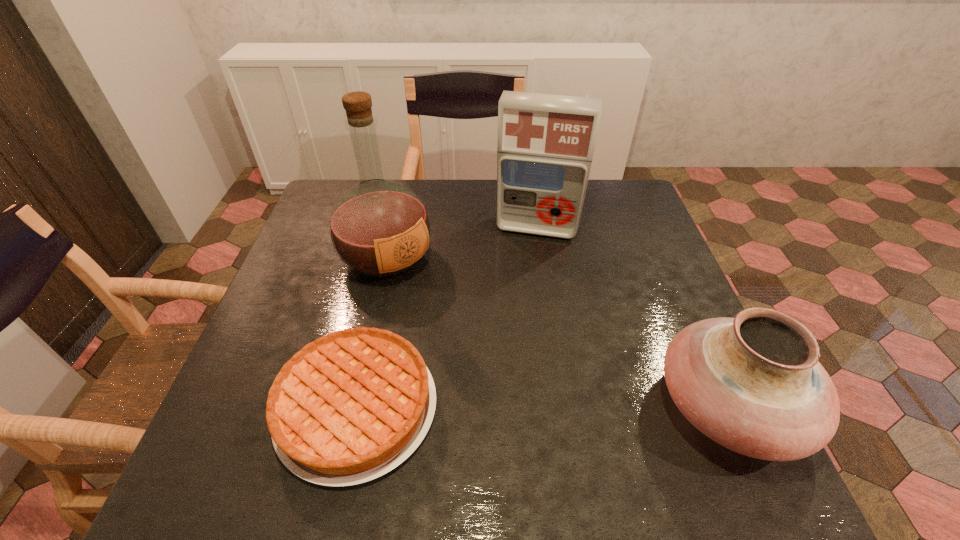
Locate an element on the screen. The width and height of the screenshot is (960, 540). vacant spot on the desktop that is between the shortest object and the pottery and is positioned on the front label of the liquor is located at coordinates (546, 407).

You are a GUI agent. You are given a task and a screenshot of the screen. Output one action in this format:
    pyautogui.click(x=<x>, y=<y>)
    Task: Click on the vacant spot on the desktop that is between the pie and the rightmost object and is positioned on the front-facing side of the first-aid kit
    This screenshot has height=540, width=960.
    Given the screenshot: What is the action you would take?
    pyautogui.click(x=502, y=407)